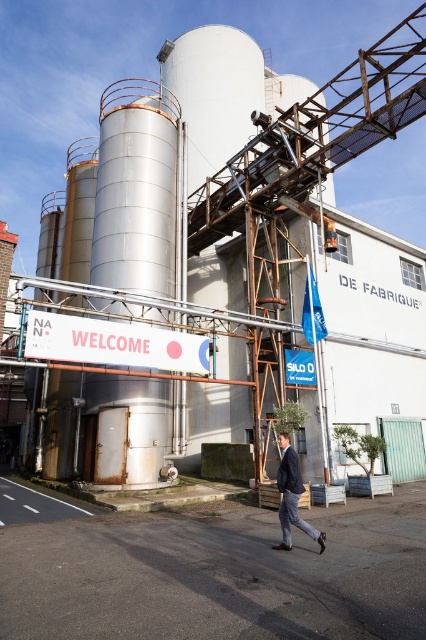
Question: Does metallic silo at center have a larger size compared to dark gray suit at center?

Choices:
 (A) no
 (B) yes

Answer: (B)

Question: Among these points, which one is farthest from the camera?

Choices:
 (A) (282, 465)
 (B) (334, 150)

Answer: (B)

Question: In this image, where is metallic silo at center located relative to dark gray suit at center?

Choices:
 (A) left
 (B) right

Answer: (B)

Question: Does metallic silo at center have a smaller size compared to dark gray suit at center?

Choices:
 (A) yes
 (B) no

Answer: (B)